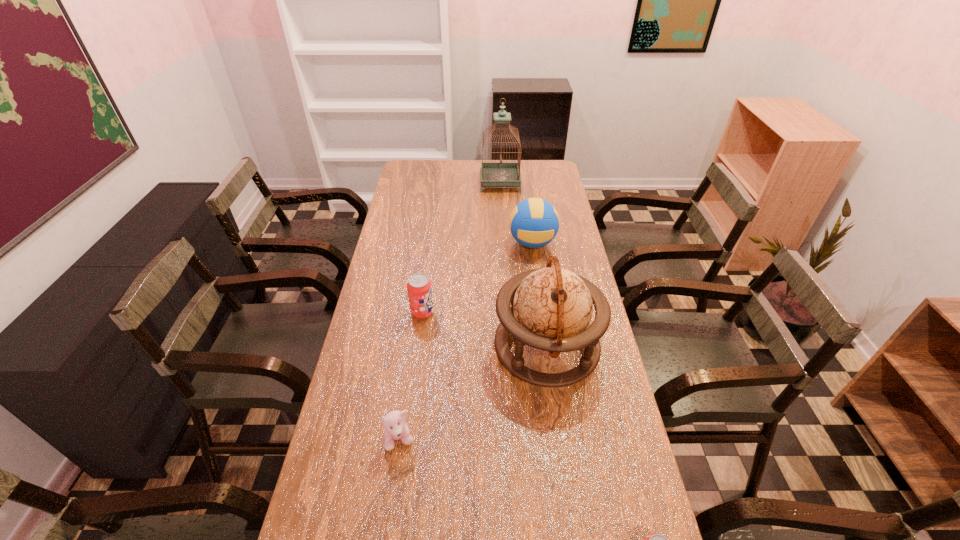
Image resolution: width=960 pixels, height=540 pixels. I want to click on free space between the second nearest object and the birdcage, so click(x=450, y=311).

Locate an element on the screen. the fifth closest object to the second farthest object is located at coordinates (654, 539).

Identify which object is the fifth nearest to the third tallest object. Please provide its 2D coordinates. Your answer should be formatted as a tuple, i.e. [(x, y)], where the tuple contains the x and y coordinates of a point satisfying the conditions above.

[(654, 539)]

At what (x,y) coordinates should I click in order to perform the action: click on free space that satisfies the following two spatial constraints: 1. at the door of the birdcage; 2. on the back side of the third tallest object. Please return your answer as a coordinate pair (x, y). Looking at the image, I should click on (504, 243).

At what (x,y) coordinates should I click in order to perform the action: click on vacant space that satisfies the following two spatial constraints: 1. at the door of the farthest object; 2. on the back side of the globe. Please return your answer as a coordinate pair (x, y). The height and width of the screenshot is (540, 960). Looking at the image, I should click on (512, 347).

Locate an element on the screen. free point that satisfies the following two spatial constraints: 1. on the front side of the volleyball; 2. on the surface of the taller soda can is located at coordinates (542, 312).

Where is `vacant space that satisfies the following two spatial constraints: 1. on the surface of the taller soda can; 2. at the face of the teddy bear`? The height and width of the screenshot is (540, 960). vacant space that satisfies the following two spatial constraints: 1. on the surface of the taller soda can; 2. at the face of the teddy bear is located at coordinates (405, 441).

Locate an element on the screen. The image size is (960, 540). vacant position in the image that satisfies the following two spatial constraints: 1. on the surface of the second tallest object; 2. on the left side of the third shortest object is located at coordinates (418, 347).

Locate an element on the screen. free space that satisfies the following two spatial constraints: 1. at the door of the farthest object; 2. at the face of the teddy bear is located at coordinates [x=517, y=441].